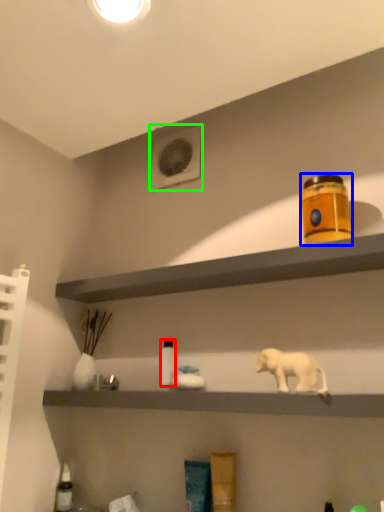
Question: Estimate the real-world distances between objects in this image. Which object is farther from bottle (highlighted by a red box), product (highlighted by a blue box) or air conditioning (highlighted by a green box)?

Choices:
 (A) product
 (B) air conditioning

Answer: (B)